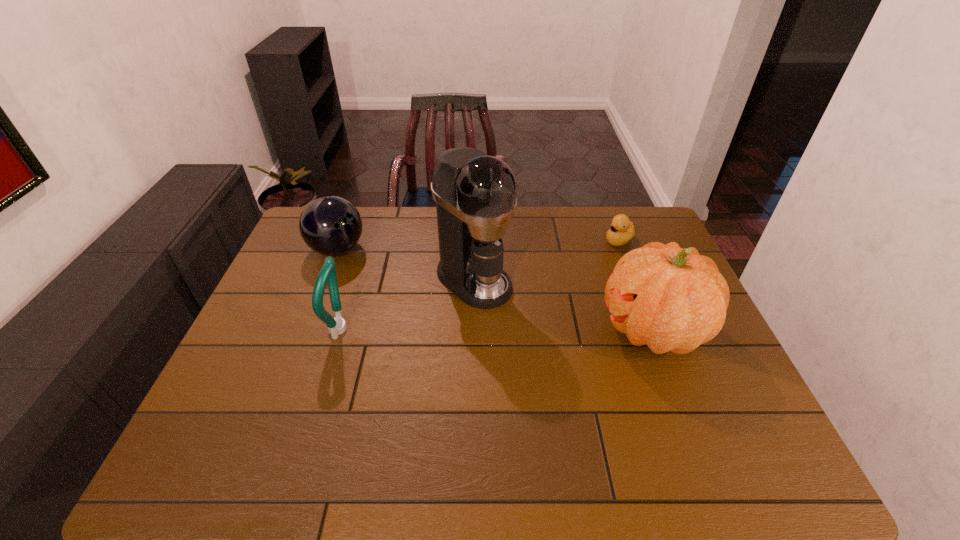
Identify the location of vacant area that lies between the second shortest object and the bottle opener. This screenshot has height=540, width=960. (340, 289).

Locate an element on the screen. The width and height of the screenshot is (960, 540). free area in between the bowling ball and the tallest object is located at coordinates (406, 265).

The image size is (960, 540). What are the coordinates of `vacant space that's between the third shortest object and the coffee maker` in the screenshot? It's located at (408, 305).

Where is `free space between the shortest object and the tallest object`? This screenshot has width=960, height=540. free space between the shortest object and the tallest object is located at coordinates (546, 260).

Where is `vacant point located between the third tallest object and the bowling ball`? vacant point located between the third tallest object and the bowling ball is located at coordinates (340, 289).

The width and height of the screenshot is (960, 540). In order to click on vacant area between the coffee maker and the fourth shortest object in this screenshot , I will do tap(564, 305).

Locate an element on the screen. vacant point located between the third object from right to left and the third shortest object is located at coordinates (408, 305).

Point out which object is positioned as the third nearest to the pumpkin. Please provide its 2D coordinates. Your answer should be formatted as a tuple, i.e. [(x, y)], where the tuple contains the x and y coordinates of a point satisfying the conditions above.

[(336, 326)]

Locate an element on the screen. the closest object to the shortest object is located at coordinates (671, 299).

The width and height of the screenshot is (960, 540). Identify the location of free space that satisfies the following two spatial constraints: 1. on the back side of the shortest object; 2. on the left side of the coffee maker. (474, 240).